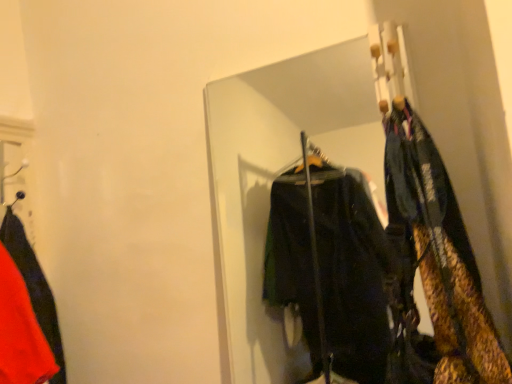
Describe the element at coordinates (26, 313) in the screenshot. The width and height of the screenshot is (512, 384). I see `red fabric jacket at left` at that location.

The image size is (512, 384). In order to click on red fabric jacket at left in this screenshot , I will do `click(26, 313)`.

Identify the location of red fabric jacket at left. Image resolution: width=512 pixels, height=384 pixels. (26, 313).